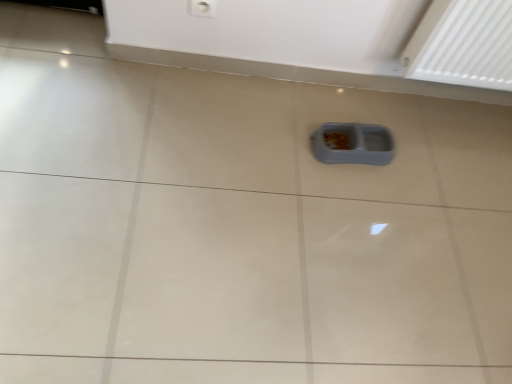
Question: Is point (359, 145) closer or farther from the camera than point (197, 3)?

Choices:
 (A) farther
 (B) closer

Answer: (A)

Question: Is gray plastic food container at center bigger or smaller than white plastic electric outlet at upper center?

Choices:
 (A) small
 (B) big

Answer: (B)

Question: Is gray plastic food container at center taller or shorter than white plastic electric outlet at upper center?

Choices:
 (A) tall
 (B) short

Answer: (B)

Question: Based on their positions, is white plastic electric outlet at upper center located to the left or right of gray plastic food container at center?

Choices:
 (A) left
 (B) right

Answer: (A)

Question: Choose the correct answer: Is white plastic electric outlet at upper center inside gray plastic food container at center or outside it?

Choices:
 (A) inside
 (B) outside

Answer: (B)

Question: From the image's perspective, is white plastic electric outlet at upper center positioned above or below gray plastic food container at center?

Choices:
 (A) below
 (B) above

Answer: (B)

Question: Does point (202, 16) appear closer or farther from the camera than point (384, 155)?

Choices:
 (A) closer
 (B) farther

Answer: (A)